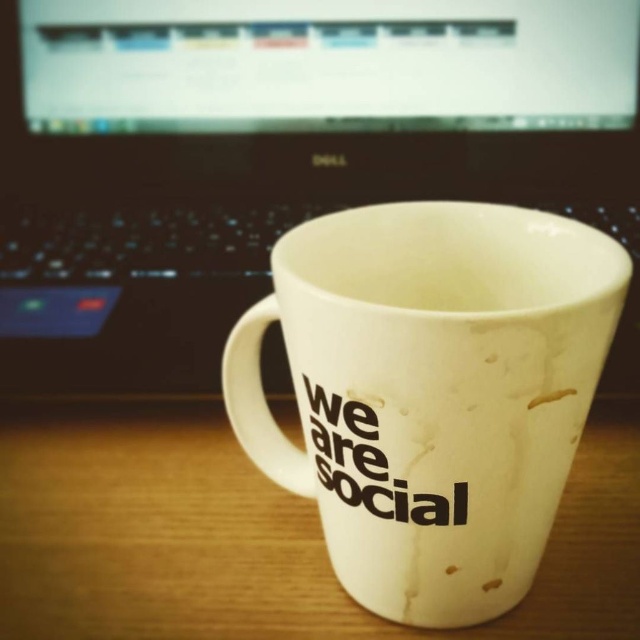
Question: Is the position of white matte mug at center less distant than that of white matte wood table at center?

Choices:
 (A) yes
 (B) no

Answer: (A)

Question: Which object is closer to the camera taking this photo?

Choices:
 (A) white matte wood table at center
 (B) black plastic laptop at center

Answer: (A)

Question: Is white matte mug at center to the left of white matte wood table at center from the viewer's perspective?

Choices:
 (A) no
 (B) yes

Answer: (A)

Question: Considering the real-world distances, which object is closest to the white matte mug at center?

Choices:
 (A) black plastic laptop at center
 (B) white matte wood table at center

Answer: (B)

Question: Estimate the real-world distances between objects in this image. Which object is farther from the black plastic laptop at center?

Choices:
 (A) white matte wood table at center
 (B) white matte mug at center

Answer: (B)

Question: Is black plastic laptop at center thinner than white matte mug at center?

Choices:
 (A) yes
 (B) no

Answer: (B)